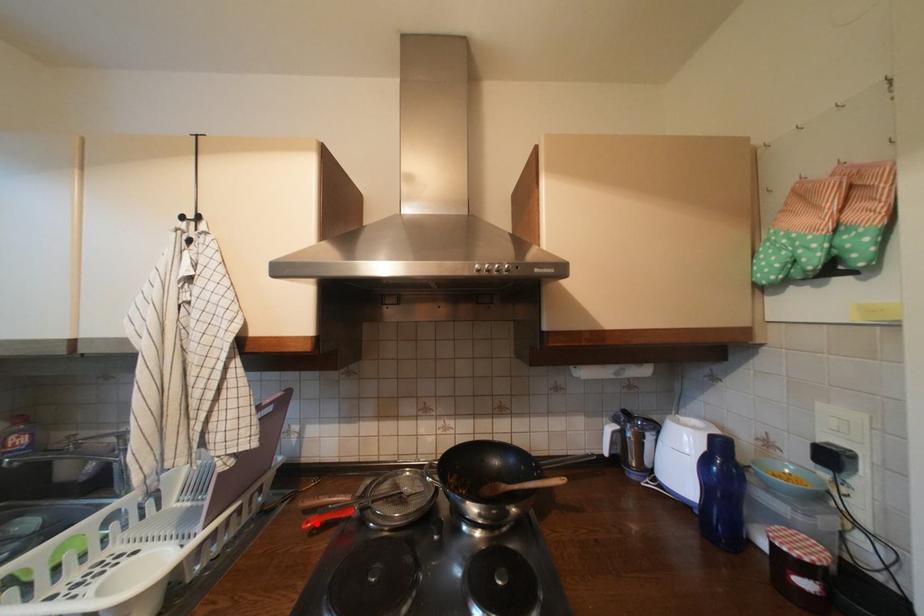
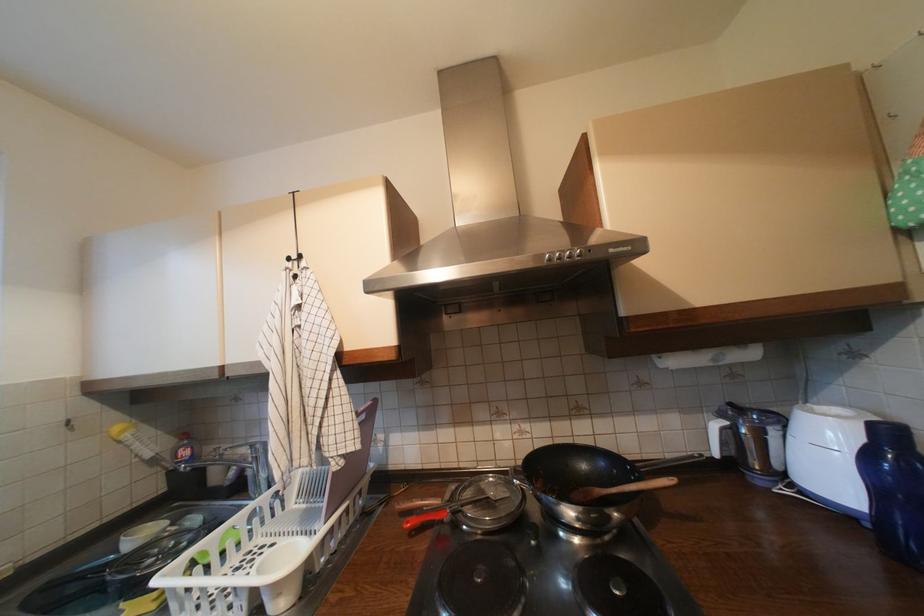
Where in the second image is the point corresponding to the highlighted location from the first image?

(417, 524)